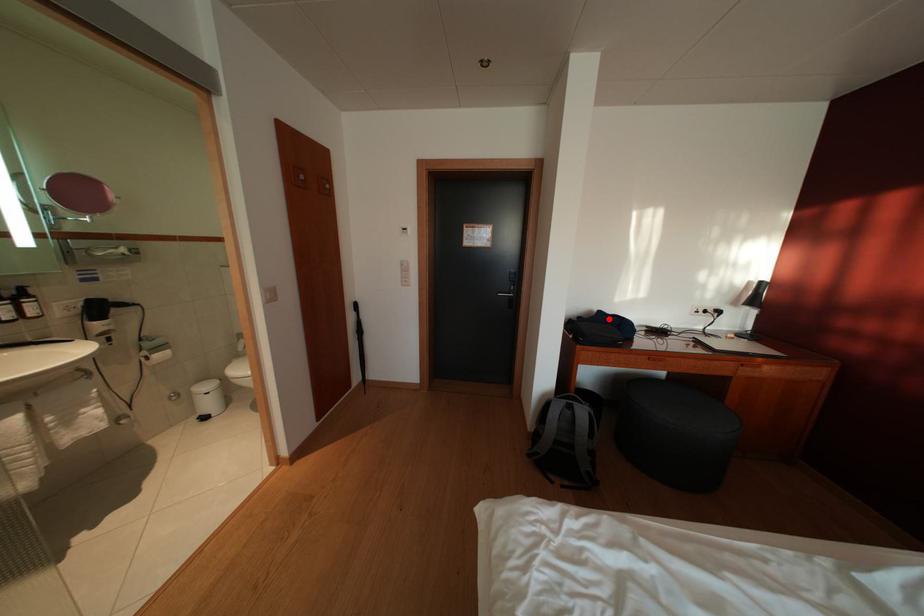
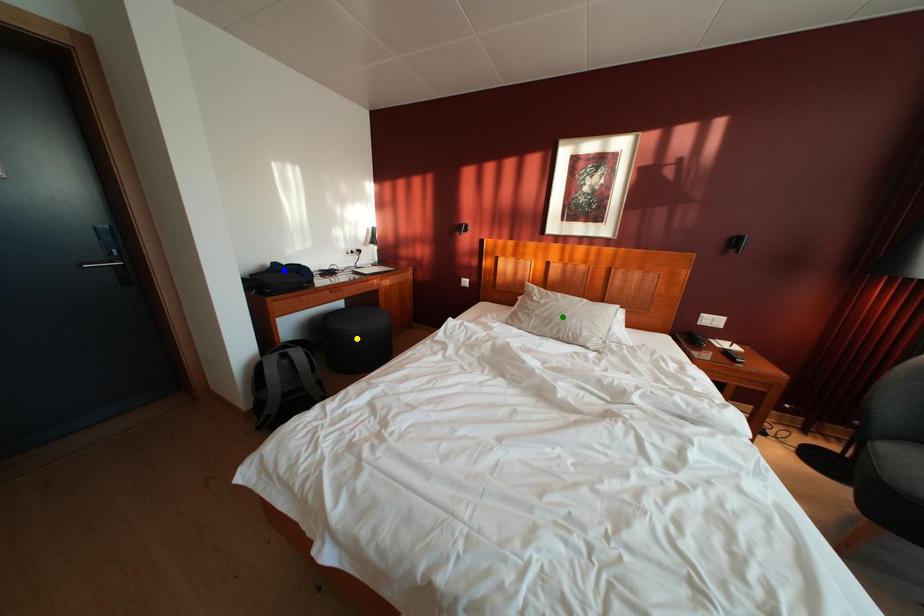
Question: I am providing you with two images of the same scene from different viewpoints. A red point is marked on the first image. You are given multiple points on the second image. Which spot in image 2 lines up with the point in image 1?

Choices:
 (A) green point
 (B) yellow point
 (C) blue point

Answer: (C)